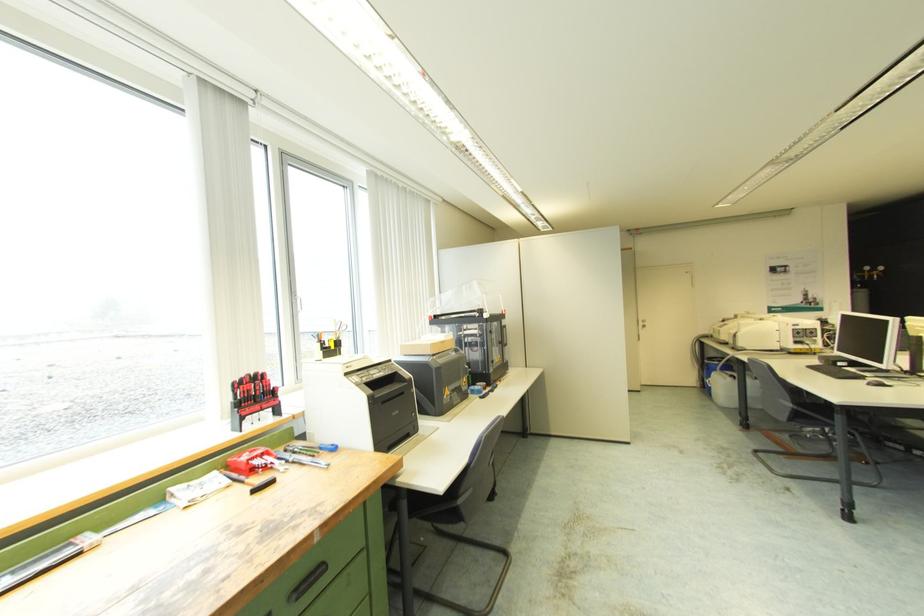
Which object does [251,390] point to?

It refers to a red handle screwdriver.